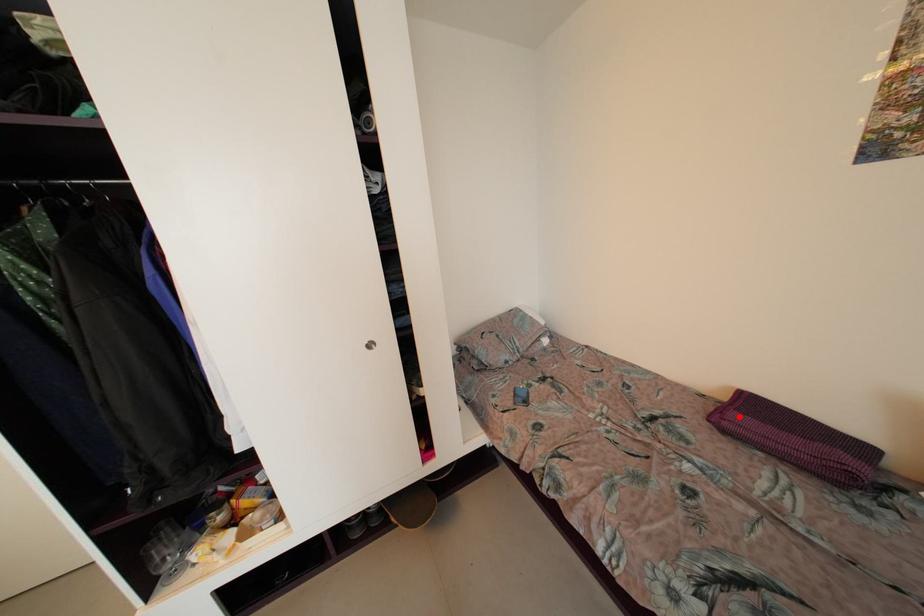
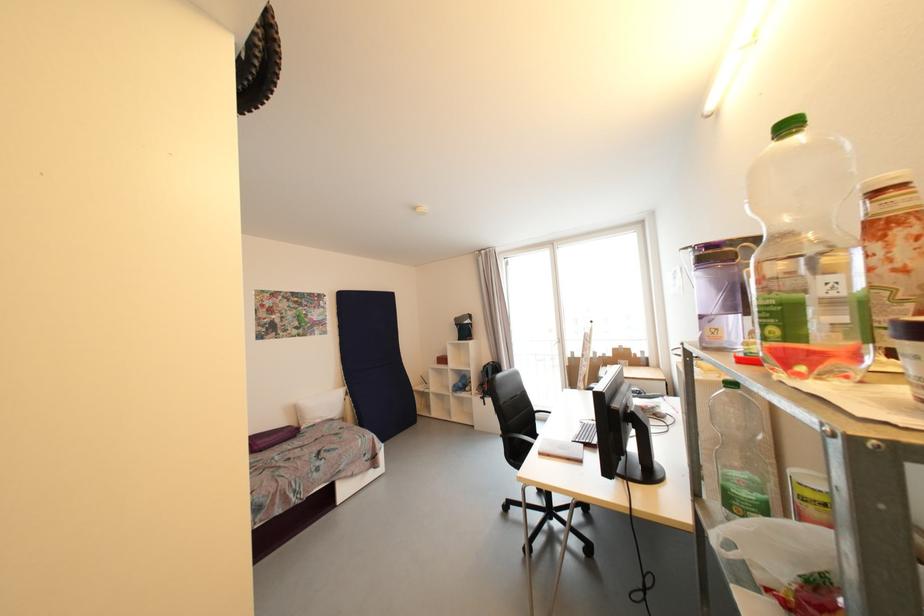
Where in the second image is the point corresponding to the highlighted location from the first image?

(263, 445)